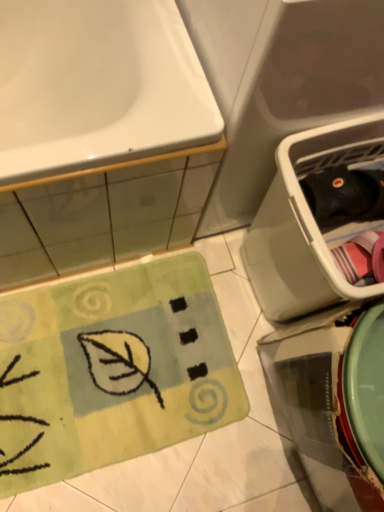
Question: From a real-world perspective, is green plush doormat at lower left physically above white glossy sink at upper left?

Choices:
 (A) yes
 (B) no

Answer: (B)

Question: Can you confirm if green plush doormat at lower left is thinner than white glossy sink at upper left?

Choices:
 (A) yes
 (B) no

Answer: (A)

Question: From the image's perspective, is green plush doormat at lower left over white glossy sink at upper left?

Choices:
 (A) yes
 (B) no

Answer: (B)

Question: From the image's perspective, is green plush doormat at lower left beneath white glossy sink at upper left?

Choices:
 (A) no
 (B) yes

Answer: (B)

Question: Does green plush doormat at lower left have a greater width compared to white glossy sink at upper left?

Choices:
 (A) yes
 (B) no

Answer: (B)

Question: Considering the positions of green plush doormat at lower left and white glossy sink at upper left in the image, is green plush doormat at lower left taller or shorter than white glossy sink at upper left?

Choices:
 (A) short
 (B) tall

Answer: (A)

Question: Is green plush doormat at lower left inside or outside of white glossy sink at upper left?

Choices:
 (A) outside
 (B) inside

Answer: (A)

Question: Is green plush doormat at lower left to the left or to the right of white glossy sink at upper left in the image?

Choices:
 (A) left
 (B) right

Answer: (B)

Question: Considering the positions of point (44, 321) and point (147, 111), is point (44, 321) closer or farther from the camera than point (147, 111)?

Choices:
 (A) farther
 (B) closer

Answer: (A)

Question: Is white glossy sink at upper left wider or thinner than green plush doormat at lower left?

Choices:
 (A) thin
 (B) wide

Answer: (B)

Question: Relative to green plush doormat at lower left, is white glossy sink at upper left in front or behind?

Choices:
 (A) front
 (B) behind

Answer: (A)

Question: From their relative heights in the image, would you say white glossy sink at upper left is taller or shorter than green plush doormat at lower left?

Choices:
 (A) tall
 (B) short

Answer: (A)

Question: From a real-world perspective, is white glossy sink at upper left positioned above or below green plush doormat at lower left?

Choices:
 (A) above
 (B) below

Answer: (A)

Question: In the image, is white glossy sink at upper left positioned in front of or behind black plastic dish washer at right?

Choices:
 (A) behind
 (B) front

Answer: (B)

Question: Choose the correct answer: Is white glossy sink at upper left inside black plastic dish washer at right or outside it?

Choices:
 (A) inside
 (B) outside

Answer: (B)